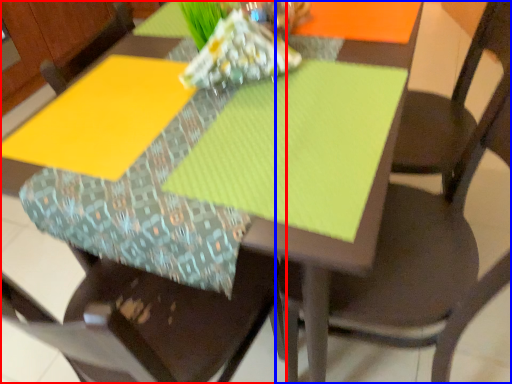
Question: Which object appears farthest to the camera in this image, chair (highlighted by a red box) or chair (highlighted by a blue box)?

Choices:
 (A) chair
 (B) chair

Answer: (B)